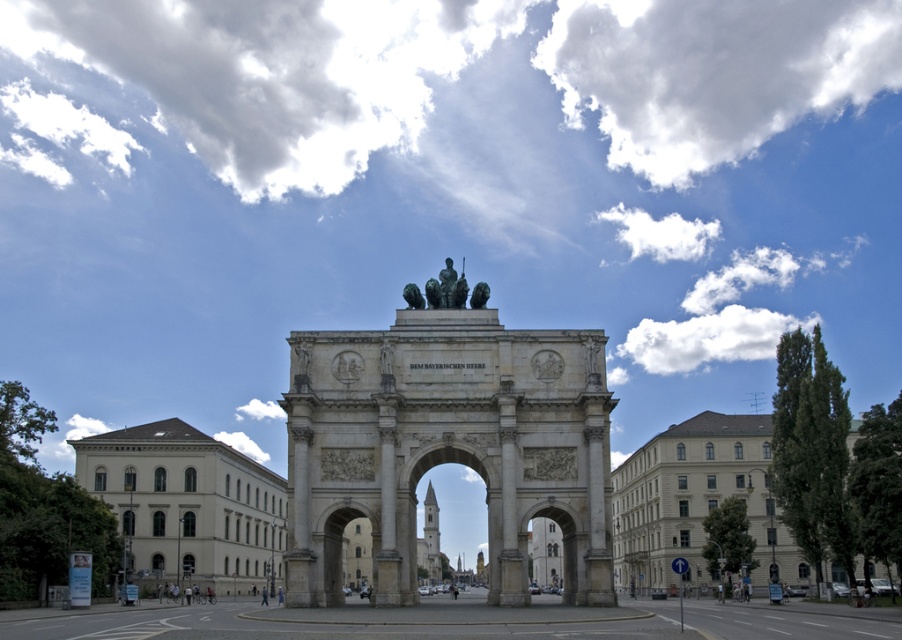
Does green patina statue at center have a smaller size compared to bronze statue at center?

No.

Can you confirm if green patina statue at center is taller than bronze statue at center?

Yes, green patina statue at center is taller than bronze statue at center.

The image size is (902, 640). Identify the location of green patina statue at center. (439, 291).

Which is below, green stone arch at center or green patina statue at center?

→ Positioned lower is green stone arch at center.

Which is behind, point (425, 410) or point (410, 291)?

Point (410, 291)

Locate an element on the screen. This screenshot has width=902, height=640. green stone arch at center is located at coordinates (446, 448).

Who is positioned more to the right, green stone arch at center or bronze statue at center?

From the viewer's perspective, green stone arch at center appears more on the right side.

Is green stone arch at center thinner than bronze statue at center?

In fact, green stone arch at center might be wider than bronze statue at center.

In order to click on green stone arch at center in this screenshot , I will do `click(446, 448)`.